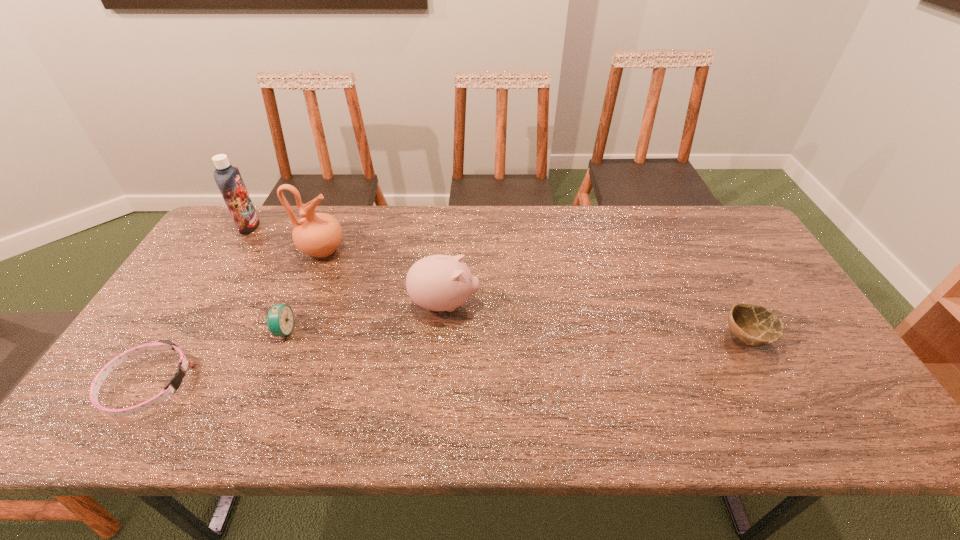
Where is `shampoo`? The height and width of the screenshot is (540, 960). shampoo is located at coordinates (228, 178).

The height and width of the screenshot is (540, 960). What are the coordinates of `pottery` in the screenshot? It's located at (317, 234).

This screenshot has width=960, height=540. In order to click on the second object from right to left in this screenshot , I will do `click(438, 282)`.

In order to click on piggy bank in this screenshot , I will do `click(438, 282)`.

In order to click on alarm clock in this screenshot , I will do `click(280, 319)`.

At what (x,y) coordinates should I click in order to perform the action: click on the rightmost object. Please return your answer as a coordinate pair (x, y). The height and width of the screenshot is (540, 960). Looking at the image, I should click on click(754, 325).

Locate an element on the screen. Image resolution: width=960 pixels, height=540 pixels. bowl is located at coordinates [x=754, y=325].

Locate an element on the screen. the shortest object is located at coordinates (176, 380).

Locate an element on the screen. The height and width of the screenshot is (540, 960). free space located 0.210m on the front label of the shampoo is located at coordinates (322, 226).

Identify the location of vacant region located 0.130m on the spout of the pottery. The width and height of the screenshot is (960, 540). (387, 249).